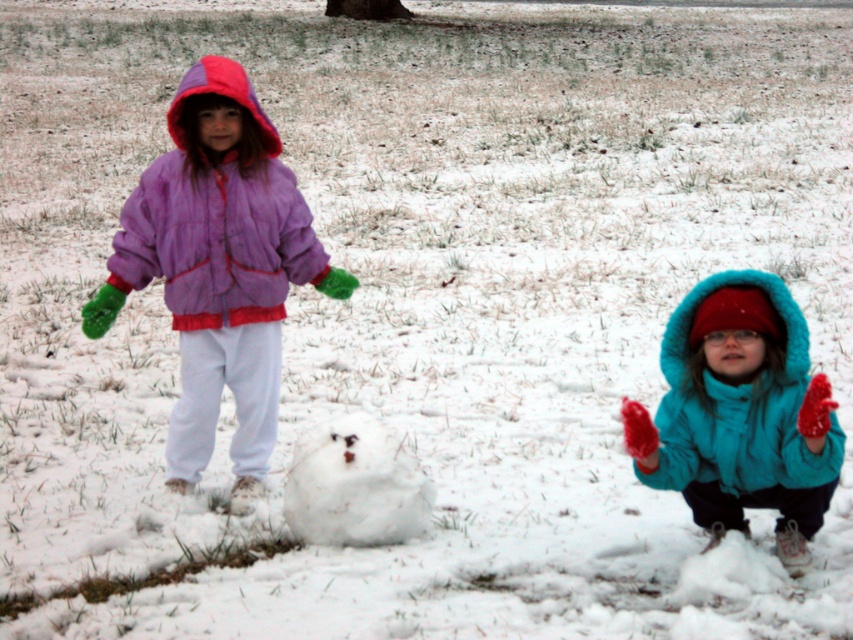
You are a parent trying to ensure your children stay within a safe distance of each other while playing in the snow. The recommended safe distance is 1.5 meters. Based on the scene, is the turquoise fleece jacket at lower right close enough to the white fluffy snowman at center to meet the safety guideline?

The turquoise fleece jacket at lower right and the white fluffy snowman at center are 1.25 meters apart from each other, which is within the recommended safe distance of 1.5 meters. Therefore, they are close enough.